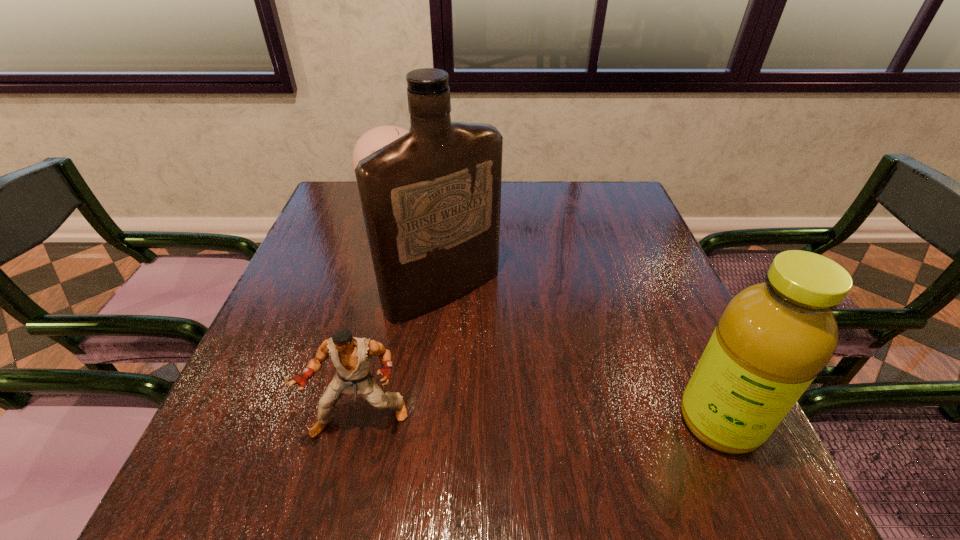
At what (x,y) coordinates should I click in order to perform the action: click on vacant space situated at the snout of the piggy bank. Please return your answer as a coordinate pair (x, y). The image size is (960, 540). Looking at the image, I should click on (457, 302).

The height and width of the screenshot is (540, 960). I want to click on free region located 0.280m at the snout of the piggy bank, so click(447, 286).

Identify the location of object that is at the far edge. (374, 139).

The height and width of the screenshot is (540, 960). I want to click on puncher at the near edge, so click(351, 356).

You are a GUI agent. You are given a task and a screenshot of the screen. Output one action in this format:
    pyautogui.click(x=<x>, y=<y>)
    Task: Click on the fruit juice present at the near edge
    This screenshot has height=540, width=960.
    Given the screenshot: What is the action you would take?
    pyautogui.click(x=773, y=338)

You are a GUI agent. You are given a task and a screenshot of the screen. Output one action in this format:
    pyautogui.click(x=<x>, y=<y>)
    Task: Click on the object at the left edge
    The image size is (960, 540).
    Given the screenshot: What is the action you would take?
    pyautogui.click(x=374, y=139)

Find the location of a particular element. Image resolution: width=960 pixels, height=540 pixels. object located in the right edge section of the desktop is located at coordinates click(x=773, y=338).

Image resolution: width=960 pixels, height=540 pixels. What are the coordinates of `object that is at the far left corner` in the screenshot? It's located at (374, 139).

The width and height of the screenshot is (960, 540). In order to click on object located at the near right corner in this screenshot , I will do `click(773, 338)`.

Image resolution: width=960 pixels, height=540 pixels. Identify the location of vacant area at the far edge. (561, 208).